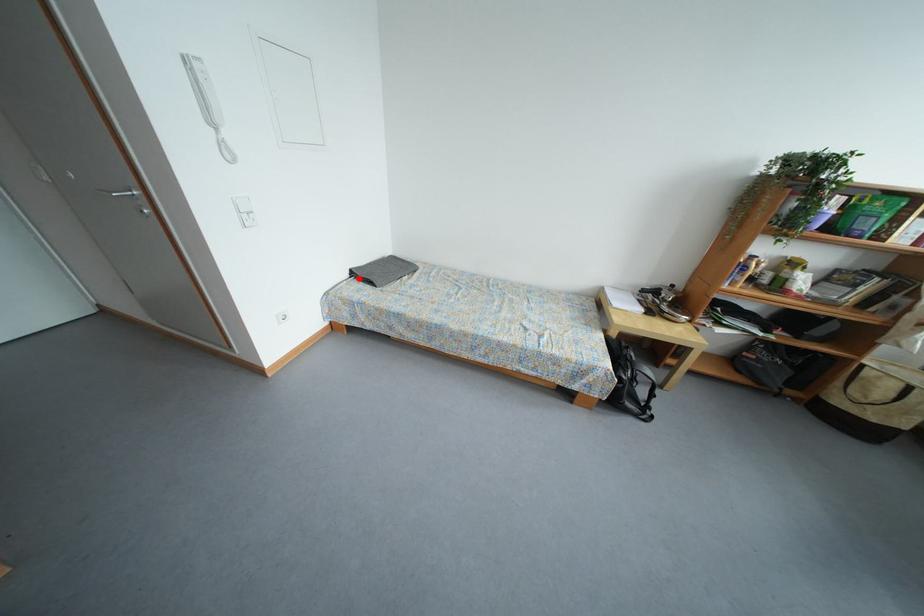
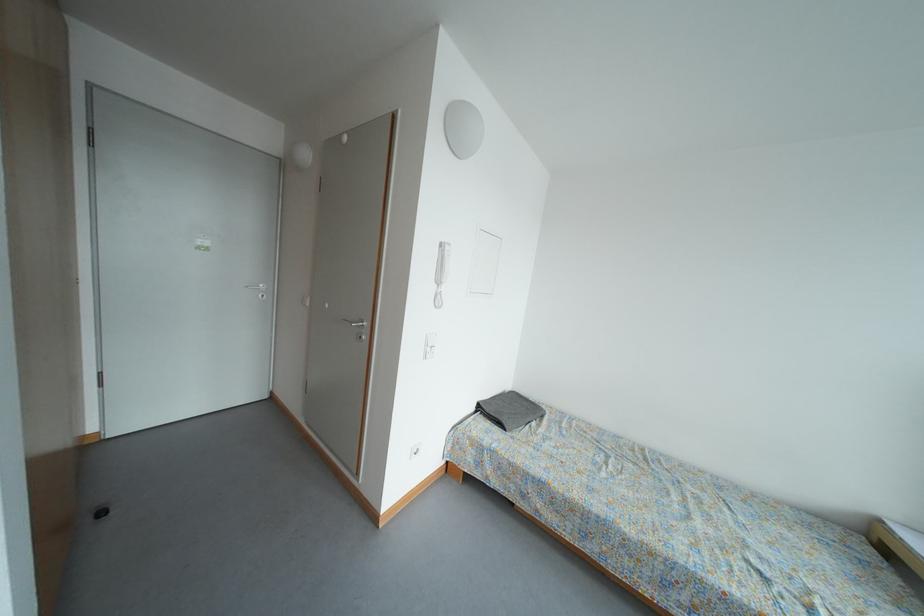
Question: A red point is marked in image1. In image2, is the corresponding 3D point closer to the camera or farther? Reply with the corresponding letter.

Choices:
 (A) The corresponding 3D point is closer.
 (B) The corresponding 3D point is farther.

Answer: (B)